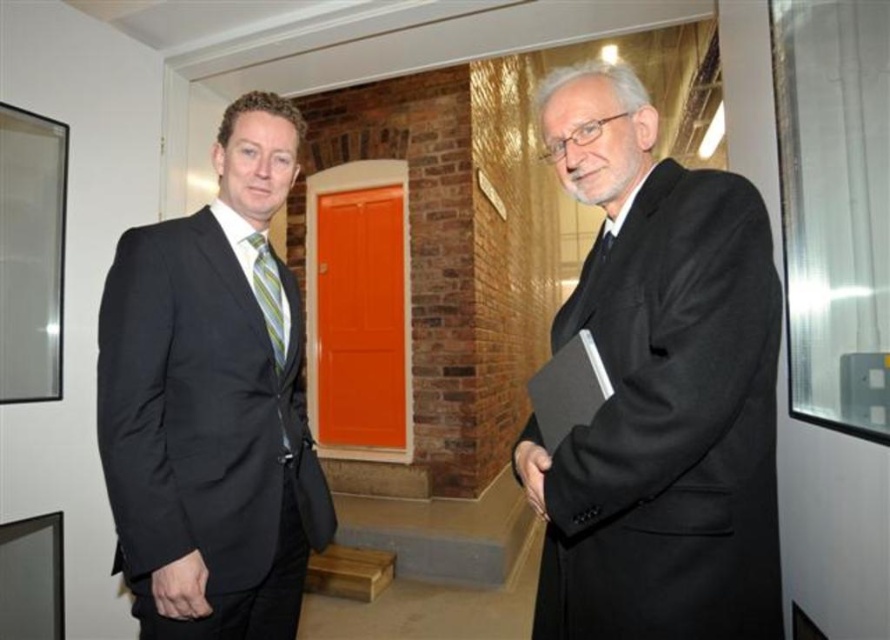
Question: Estimate the real-world distances between objects in this image. Which object is closer to the black matte suit at center?

Choices:
 (A) black smooth hand at lower left
 (B) black suit at left

Answer: (B)

Question: Which object appears farthest from the camera in this image?

Choices:
 (A) black suit at left
 (B) black matte suit at center
 (C) black smooth hand at lower left

Answer: (C)

Question: Is black suit at left thinner than smooth black hand at right?

Choices:
 (A) yes
 (B) no

Answer: (B)

Question: Does green striped tie at left have a smaller size compared to smooth black hand at right?

Choices:
 (A) yes
 (B) no

Answer: (B)

Question: Among these points, which one is nearest to the camera?

Choices:
 (A) (193, 593)
 (B) (609, 234)
 (C) (274, 557)
 (D) (522, 477)

Answer: (A)

Question: Is black smooth hand at lower left further to camera compared to smooth black hand at right?

Choices:
 (A) no
 (B) yes

Answer: (B)